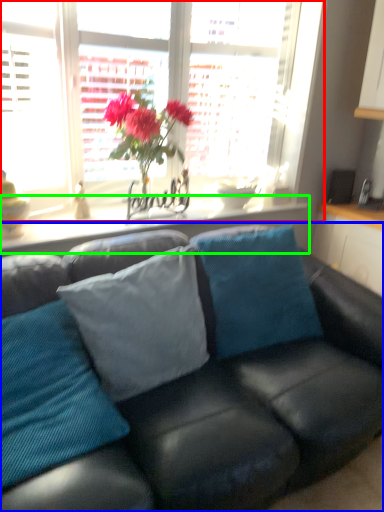
Question: Which is nearer to the window (highlighted by a red box)? studio couch (highlighted by a blue box) or window sill (highlighted by a green box).

Choices:
 (A) studio couch
 (B) window sill

Answer: (B)